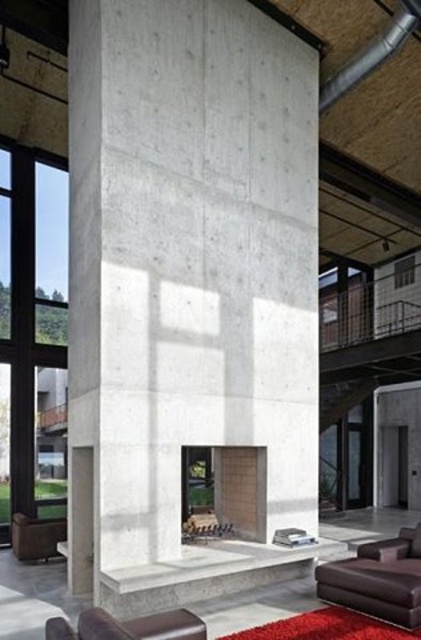
You are an interior designer planning to hang a large painting that requires a 2.5 meters high wall space. You observe the transparent glass window at left and the matte concrete fireplace at lower center. Which object provides a suitable wall space for the painting?

The transparent glass window at left has a greater height compared to the matte concrete fireplace at lower center, so it can accommodate the 2.5 meters high painting.

Based on the photo, you are standing in the room and see two points marked in the image. Which point is closer to you, point (45, 164) or point (263, 502)?

Point (45, 164) is closer to you because it is further to the camera than point (263, 502).

You are designing a layout for a new living room and want to place a 1.5 meter wide sofa between the brown leather armchair at lower left and the clear glass window at upper center. Considering their widths, will the sofa fit in the space between them?

The brown leather armchair at lower left is wider than the clear glass window at upper center. However, the sofa requires a space that accommodates its 1.5 meter width. Without knowing the exact distance between the two objects, it is impossible to determine if the sofa will fit solely based on their widths.